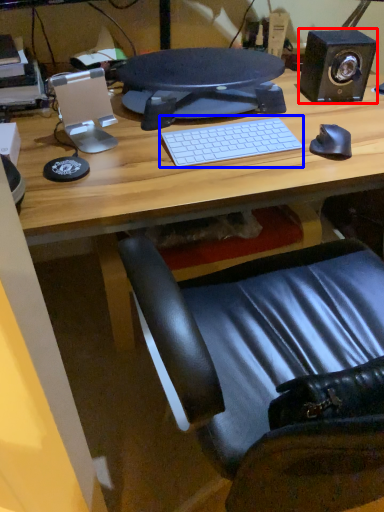
Question: Which of the following is the closest to the observer, speaker (highlighted by a red box) or computer keyboard (highlighted by a blue box)?

Choices:
 (A) speaker
 (B) computer keyboard

Answer: (B)